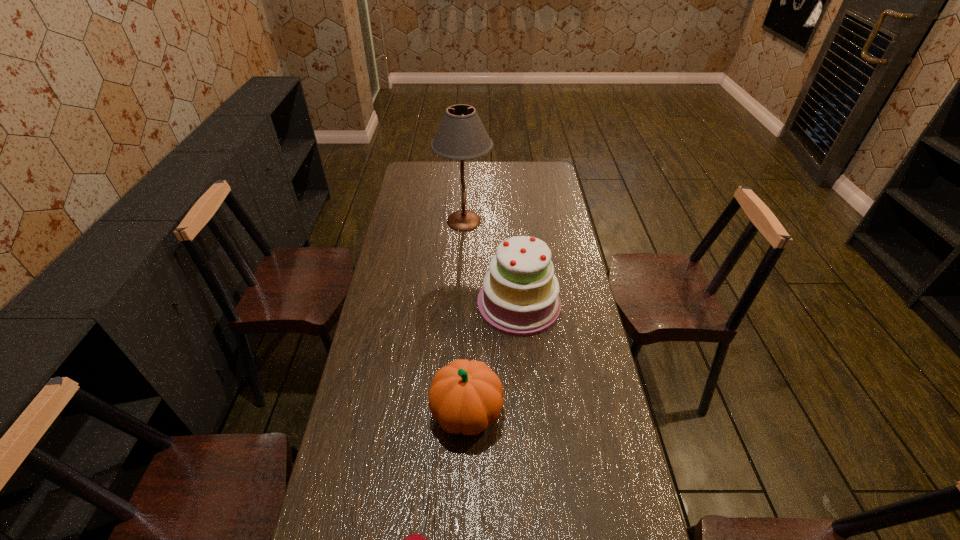
In the image, there is a desktop. Where is `vacant space at the far edge`? The width and height of the screenshot is (960, 540). vacant space at the far edge is located at coordinates (523, 170).

The width and height of the screenshot is (960, 540). I want to click on free space at the left edge, so click(x=409, y=267).

This screenshot has width=960, height=540. I want to click on vacant region at the right edge, so click(564, 211).

In order to click on vacant region at the far right corner in this screenshot , I will do `click(535, 168)`.

This screenshot has width=960, height=540. What are the coordinates of `vacant space in between the pumpkin and the third nearest object` in the screenshot? It's located at (492, 359).

Find the location of a particular element. The height and width of the screenshot is (540, 960). vacant space in between the second nearest object and the third shortest object is located at coordinates (492, 359).

Find the location of a particular element. The width and height of the screenshot is (960, 540). free space that is in between the cake and the third farthest object is located at coordinates (492, 359).

At what (x,y) coordinates should I click in order to perform the action: click on vacant area that lies between the tallest object and the pumpkin. Please return your answer as a coordinate pair (x, y). The image size is (960, 540). Looking at the image, I should click on (466, 316).

Where is `empty space between the second farthest object and the third farthest object`? This screenshot has width=960, height=540. empty space between the second farthest object and the third farthest object is located at coordinates (492, 359).

The width and height of the screenshot is (960, 540). I want to click on free space between the pumpkin and the second tallest object, so click(x=492, y=359).